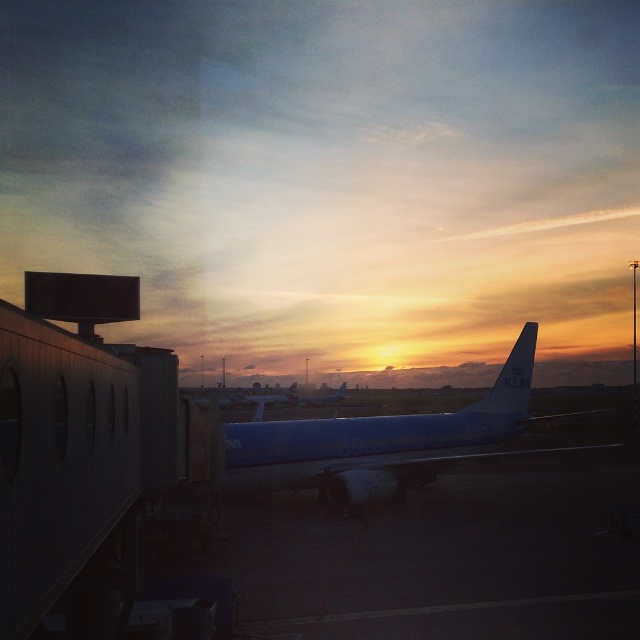
You are standing at the airport jet bridge on the left side of the image. You see a point marked at coordinates (x=376, y=442). What object is located at that point?

The point at coordinates (x=376, y=442) corresponds to the blue matte airplane at center.

You are an airport maintenance worker who needs to inspect both the blue glossy airplane at center and the blue polished airplane at center. Which airplane should you check first if you are standing on the ground and want to start with the one that is closer to you?

The blue polished airplane at center is closer to you because it is positioned below the blue glossy airplane at center, so you should start with the blue polished airplane at center.